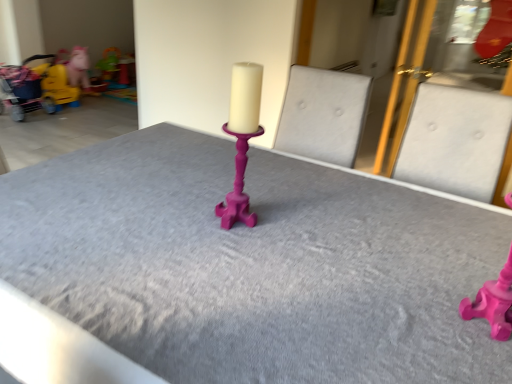
Question: Is matte pink candlestick at center touching matte yellow toy at left, which appears as the 2th toy when viewed from the front?

Choices:
 (A) yes
 (B) no

Answer: (B)

Question: Is matte pink candlestick at center to the right of matte yellow toy at left, which appears as the 2th toy when viewed from the front, from the viewer's perspective?

Choices:
 (A) yes
 (B) no

Answer: (A)

Question: Is matte yellow toy at left, which is the 2th toy from back to front, a part of matte pink candlestick at center?

Choices:
 (A) no
 (B) yes

Answer: (A)

Question: Considering the relative sizes of matte pink candlestick at center and matte yellow toy at left, which is the 2th toy from back to front, in the image provided, is matte pink candlestick at center wider than matte yellow toy at left, which is the 2th toy from back to front,?

Choices:
 (A) yes
 (B) no

Answer: (A)

Question: From a real-world perspective, is matte pink candlestick at center on matte yellow toy at left, acting as the second toy starting from the top?

Choices:
 (A) yes
 (B) no

Answer: (A)

Question: Would you say yellow fabric baby carriage at left is to the left or to the right of matte yellow toy at left, the second toy ordered from the bottom, in the picture?

Choices:
 (A) left
 (B) right

Answer: (A)

Question: Considering the positions of yellow fabric baby carriage at left and matte yellow toy at left, acting as the second toy starting from the top, in the image, is yellow fabric baby carriage at left bigger or smaller than matte yellow toy at left, acting as the second toy starting from the top,?

Choices:
 (A) big
 (B) small

Answer: (A)

Question: In terms of height, does yellow fabric baby carriage at left look taller or shorter compared to matte yellow toy at left, which is the 2th toy from back to front?

Choices:
 (A) short
 (B) tall

Answer: (B)

Question: Is yellow fabric baby carriage at left situated inside matte yellow toy at left, the second toy ordered from the bottom, or outside?

Choices:
 (A) inside
 (B) outside

Answer: (B)

Question: Is point (58, 74) closer or farther from the camera than point (66, 210)?

Choices:
 (A) farther
 (B) closer

Answer: (A)

Question: In the image, is matte yellow toy at left, the second toy ordered from the bottom, on the left side or the right side of matte pink candlestick at center?

Choices:
 (A) left
 (B) right

Answer: (A)

Question: In terms of height, does matte yellow toy at left, which is the 2th toy from back to front, look taller or shorter compared to matte pink candlestick at center?

Choices:
 (A) tall
 (B) short

Answer: (B)

Question: From a real-world perspective, is matte yellow toy at left, which is counted as the first toy, starting from the left, positioned above or below matte pink candlestick at center?

Choices:
 (A) above
 (B) below

Answer: (B)

Question: Is matte yellow plastic toy at upper left, marked as the third toy in a bottom-to-top arrangement, in front of or behind yellow fabric baby carriage at left in the image?

Choices:
 (A) front
 (B) behind

Answer: (B)

Question: Visually, is matte yellow plastic toy at upper left, positioned as the third toy in front-to-back order, positioned to the left or to the right of yellow fabric baby carriage at left?

Choices:
 (A) left
 (B) right

Answer: (B)